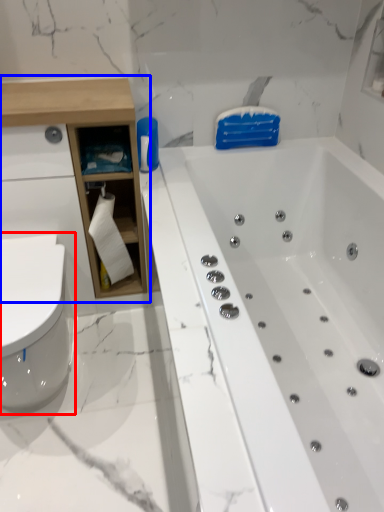
Question: Which object is closer to the camera taking this photo, toilet (highlighted by a red box) or cabinetry (highlighted by a blue box)?

Choices:
 (A) toilet
 (B) cabinetry

Answer: (A)